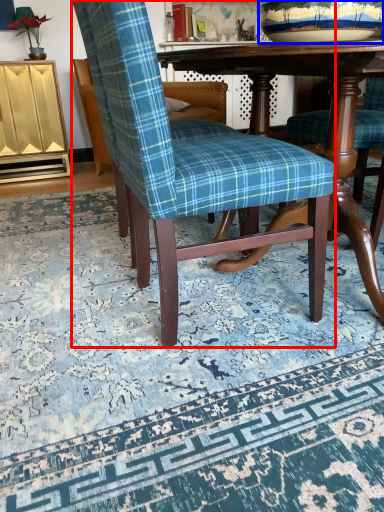
Question: Which point is further to the camera, chair (highlighted by a red box) or bowl (highlighted by a blue box)?

Choices:
 (A) chair
 (B) bowl

Answer: (B)